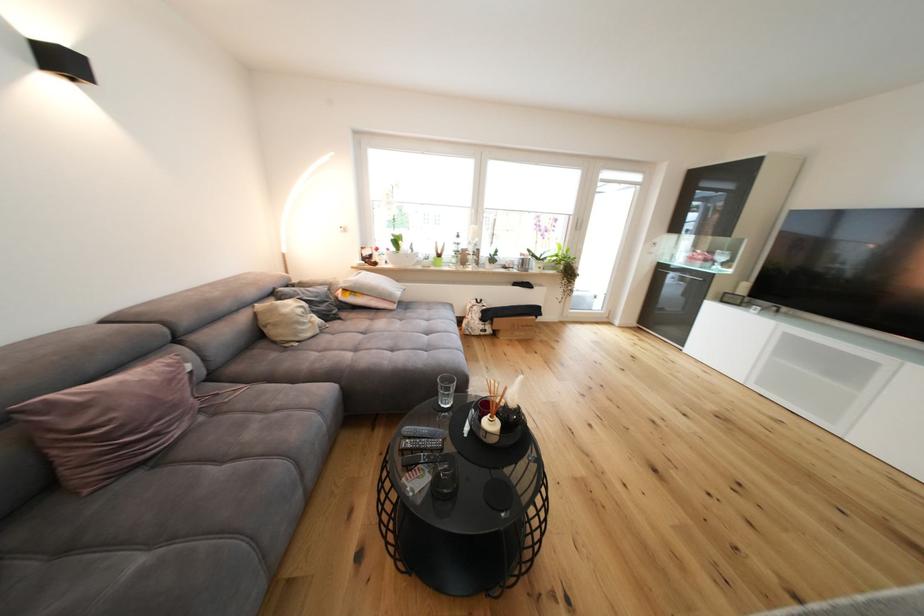
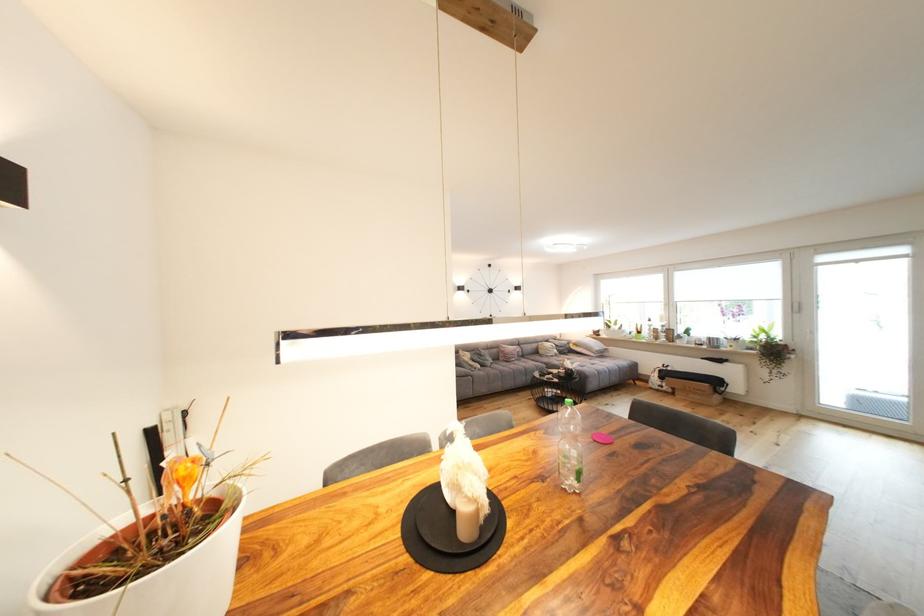
Find the pixel in the second image that matches pixel 309 286 in the first image.

(566, 342)